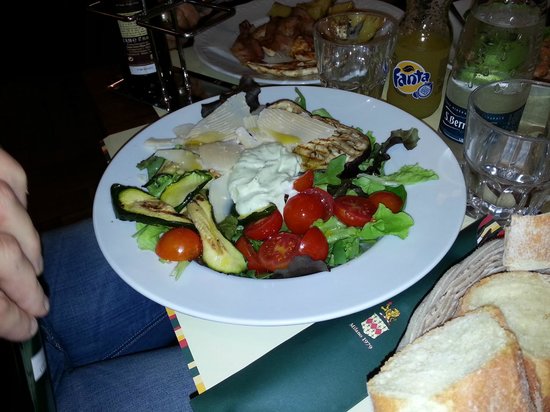
Locate an element on the screen. Image resolution: width=550 pixels, height=412 pixels. ceramic plate is located at coordinates (285, 293).